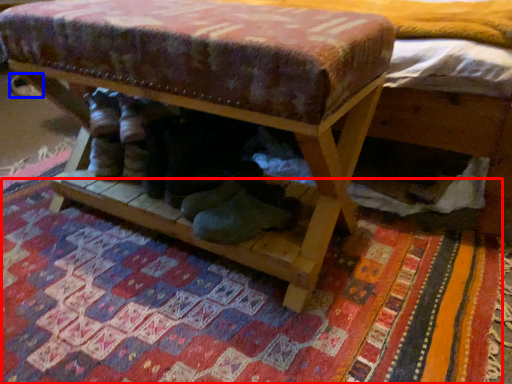
Question: Which object is closer to the camera taking this photo, mat (highlighted by a red box) or shoe (highlighted by a blue box)?

Choices:
 (A) mat
 (B) shoe

Answer: (A)